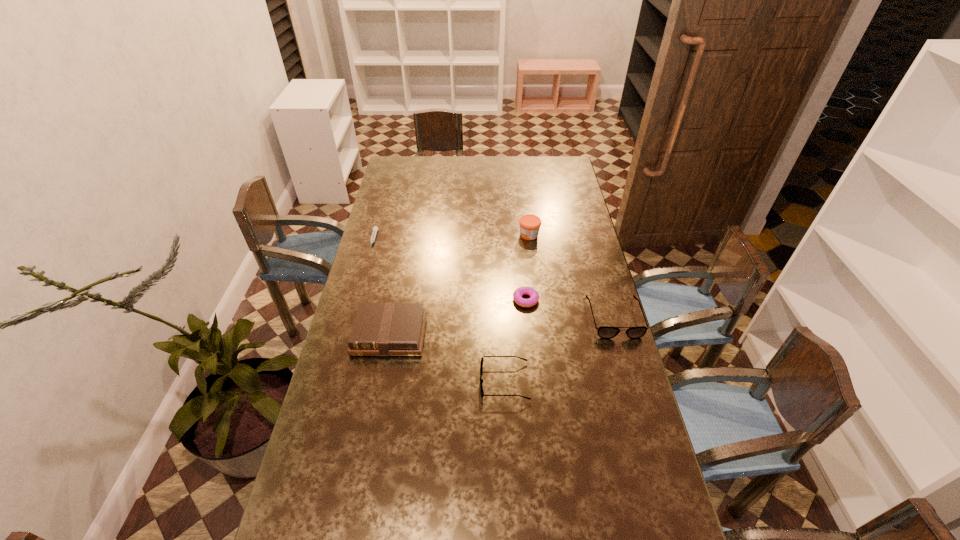
This screenshot has height=540, width=960. Identify the location of the nearest object. (481, 364).

The width and height of the screenshot is (960, 540). Find the location of `the third shortest object`. the third shortest object is located at coordinates (481, 364).

Find the location of a particular element. Image resolution: width=960 pixels, height=540 pixels. the farther spectacles is located at coordinates (605, 332).

The width and height of the screenshot is (960, 540). In order to click on the taller spectacles in this screenshot , I will do `click(605, 332)`.

Find the location of a particular element. The height and width of the screenshot is (540, 960). jam is located at coordinates (530, 224).

At what (x,y) coordinates should I click in order to perform the action: click on syringe. Please return your answer as a coordinate pair (x, y). Looking at the image, I should click on (375, 228).

Find the location of `the leftmost object`. the leftmost object is located at coordinates (375, 228).

The width and height of the screenshot is (960, 540). I want to click on the second object from left to right, so click(379, 329).

I want to click on doughnut, so click(x=517, y=295).

You are a GUI agent. You are given a task and a screenshot of the screen. Output one action in this format:
    pyautogui.click(x=<x>, y=<y>)
    Task: Click on the vacant space situated on the front-facing side of the third shortest object
    This screenshot has height=540, width=960.
    Given the screenshot: What is the action you would take?
    pyautogui.click(x=356, y=381)